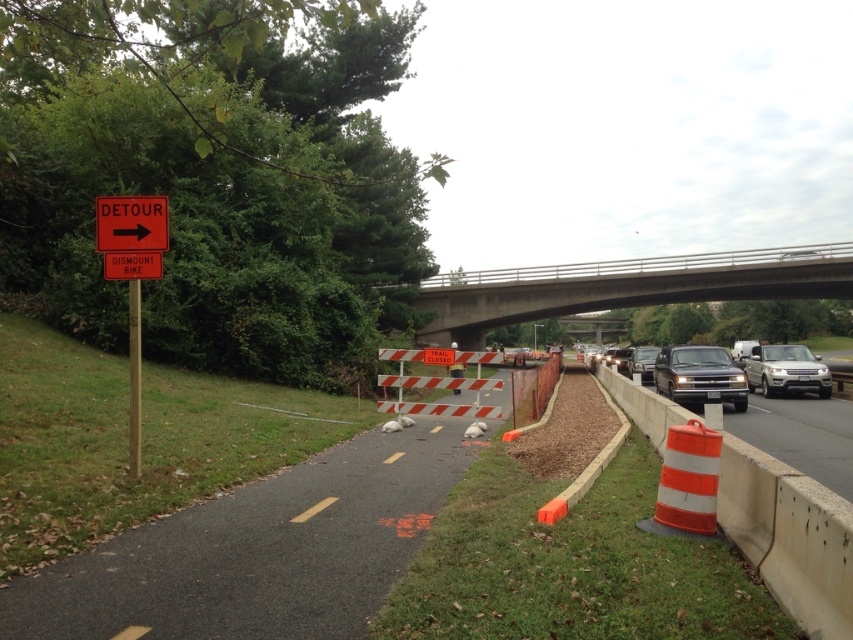
You are a cyclist approaching the detour sign and need to navigate around the construction site. The orange reflective plastic sign at upper left is directing traffic. Where is the orange striped barrier at right located relative to the sign?

The orange striped barrier at right is positioned under the orange reflective plastic sign at upper left.

You are a cyclist approaching the construction site and see the orange striped barrier at right and the orange reflective plastic sign at upper left. Which object is larger in size?

The orange reflective plastic sign at upper left is larger than the orange striped barrier at right.